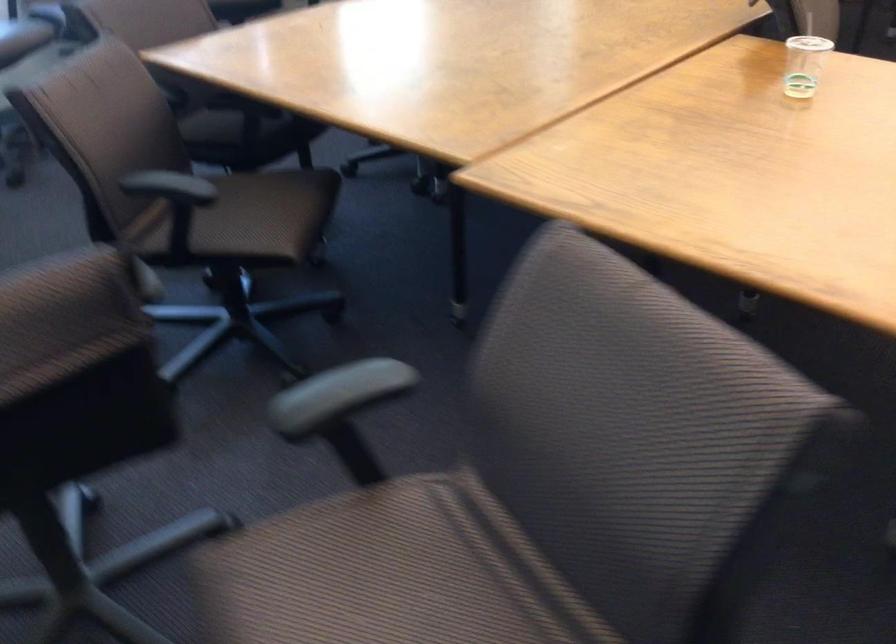
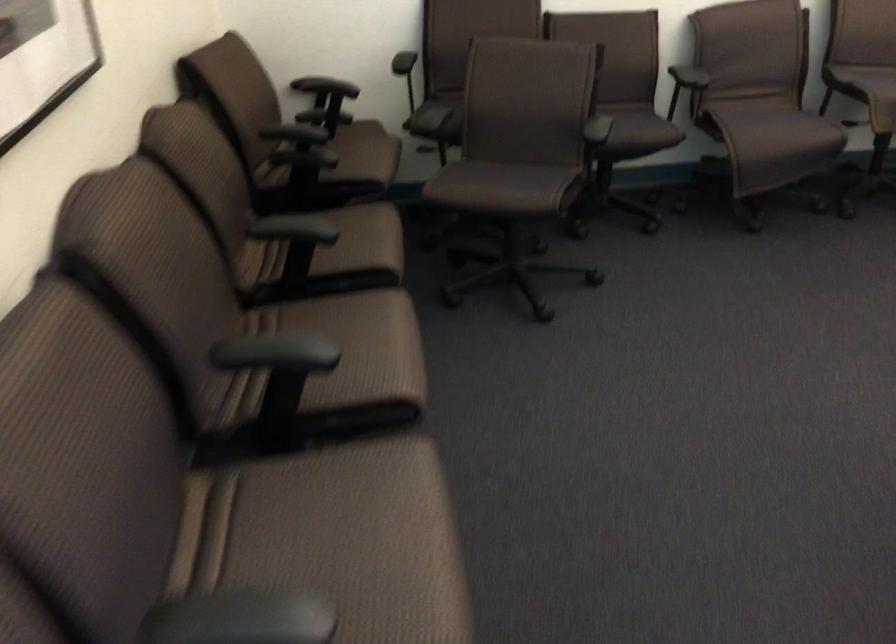
Question: Which direction would the cameraman need to move to produce the second image? Reply with the corresponding letter.

Choices:
 (A) Left
 (B) Right
 (C) Forward
 (D) Backward

Answer: (D)